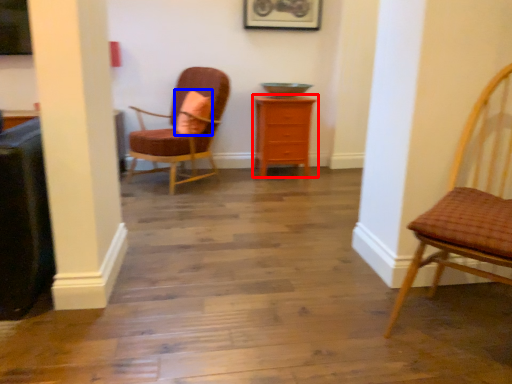
Question: Which point is closer to the camera, chest of drawers (highlighted by a red box) or pillow (highlighted by a blue box)?

Choices:
 (A) chest of drawers
 (B) pillow

Answer: (B)